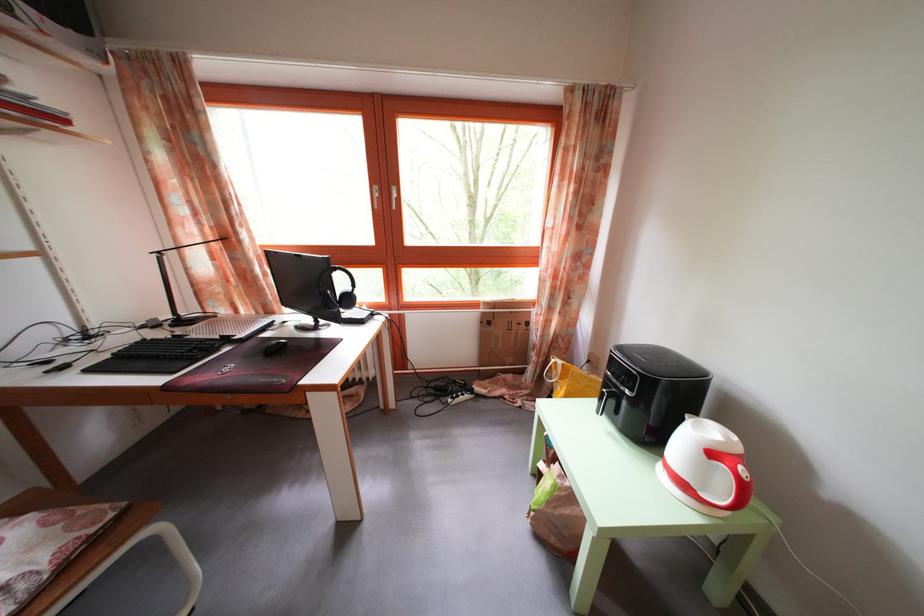
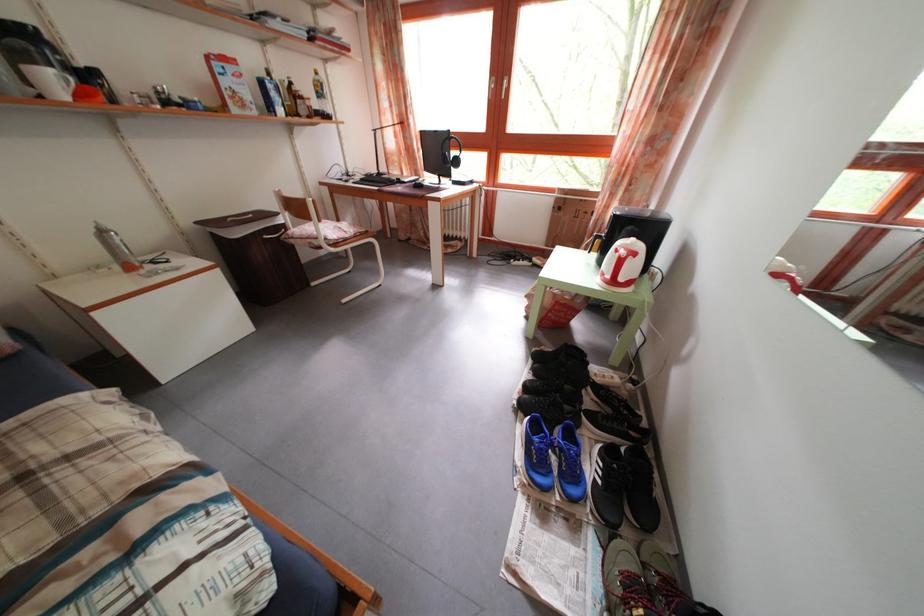
Where in the second image is the point corresponding to pixel 747 464 from the first image?

(641, 262)